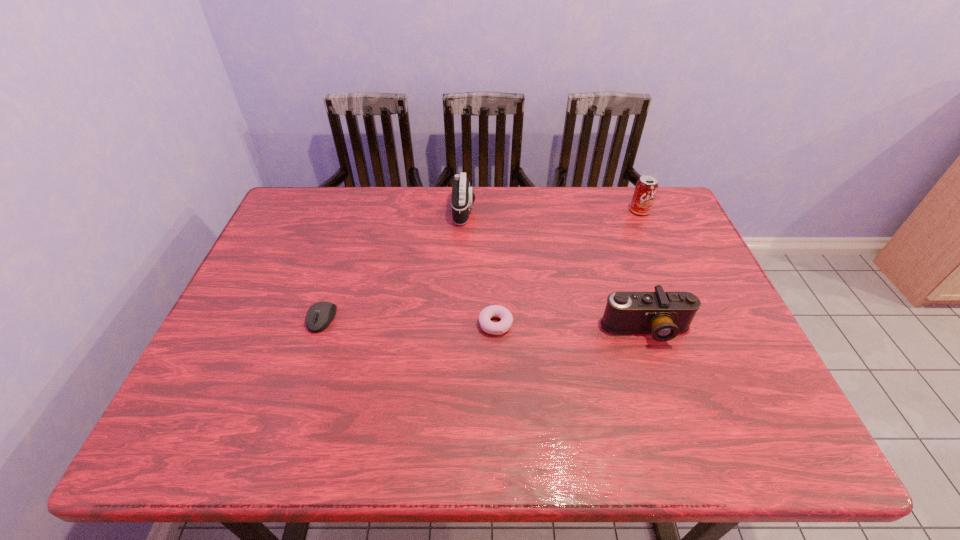
Image resolution: width=960 pixels, height=540 pixels. Find the location of `vacant area at the near left corner`. vacant area at the near left corner is located at coordinates (220, 428).

Locate an element on the screen. vacant region at the near right corner of the desktop is located at coordinates (714, 432).

Find the location of `vacant space that is in between the doughnut and the nearer camera`. vacant space that is in between the doughnut and the nearer camera is located at coordinates (571, 327).

Find the location of a particular element. The width and height of the screenshot is (960, 540). blank region between the third object from right to left and the leftmost object is located at coordinates (409, 321).

At what (x,y) coordinates should I click in order to perform the action: click on unoccupied area between the farther camera and the leftmost object. Please return your answer as a coordinate pair (x, y). Looking at the image, I should click on (394, 264).

Identify the location of free space between the left camera and the soda can. (552, 211).

Locate an element on the screen. free space that is in between the soda can and the right camera is located at coordinates (643, 271).

The image size is (960, 540). I want to click on vacant area that lies between the third object from left to right and the nearer camera, so click(x=571, y=327).

The height and width of the screenshot is (540, 960). I want to click on free area in between the left camera and the third object from right to left, so click(x=480, y=267).

The height and width of the screenshot is (540, 960). Identify the location of empty space that is in between the computer equipment and the soda can. (481, 265).